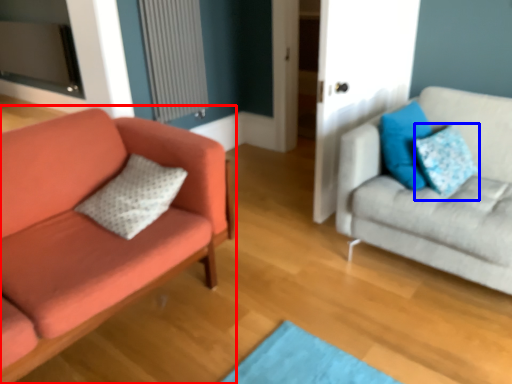
Question: Among these objects, which one is farthest to the camera, studio couch (highlighted by a red box) or pillow (highlighted by a blue box)?

Choices:
 (A) studio couch
 (B) pillow

Answer: (B)